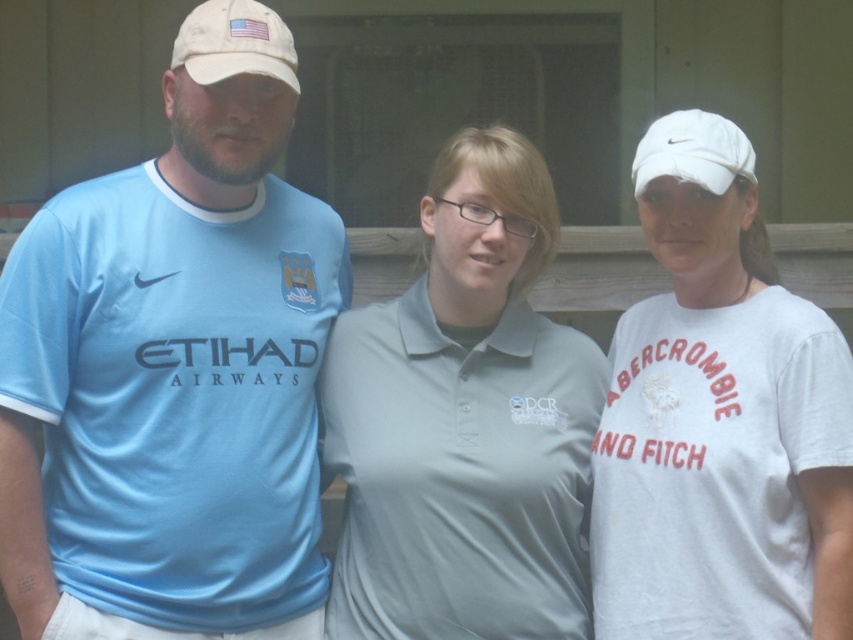
Locate an element on the screen. The height and width of the screenshot is (640, 853). white cotton t-shirt at right is located at coordinates (718, 420).

Based on the photo, is white cotton t-shirt at right taller than white fabric baseball cap at upper left?

Correct, white cotton t-shirt at right is much taller as white fabric baseball cap at upper left.

Who is more forward, (645, 451) or (206, 67)?

Point (206, 67) is in front.

This screenshot has height=640, width=853. Identify the location of white cotton t-shirt at right. (718, 420).

Can you confirm if light blue jersey at left is smaller than gray cotton polo shirt at center?

Incorrect, light blue jersey at left is not smaller in size than gray cotton polo shirt at center.

Which is more to the left, light blue jersey at left or gray cotton polo shirt at center?

light blue jersey at left is more to the left.

Which is in front, point (277, 484) or point (444, 492)?

Point (444, 492) is more forward.

The image size is (853, 640). What are the coordinates of `light blue jersey at left` in the screenshot? It's located at (173, 369).

What do you see at coordinates (459, 474) in the screenshot?
I see `gray cotton polo shirt at center` at bounding box center [459, 474].

Can you confirm if gray cotton polo shirt at center is wider than white fabric baseball cap at upper left?

Indeed, gray cotton polo shirt at center has a greater width compared to white fabric baseball cap at upper left.

This screenshot has height=640, width=853. What do you see at coordinates (459, 474) in the screenshot? I see `gray cotton polo shirt at center` at bounding box center [459, 474].

You are a GUI agent. You are given a task and a screenshot of the screen. Output one action in this format:
    pyautogui.click(x=<x>, y=<y>)
    Task: Click on the gray cotton polo shirt at center
    This screenshot has width=853, height=640.
    Given the screenshot: What is the action you would take?
    pyautogui.click(x=459, y=474)